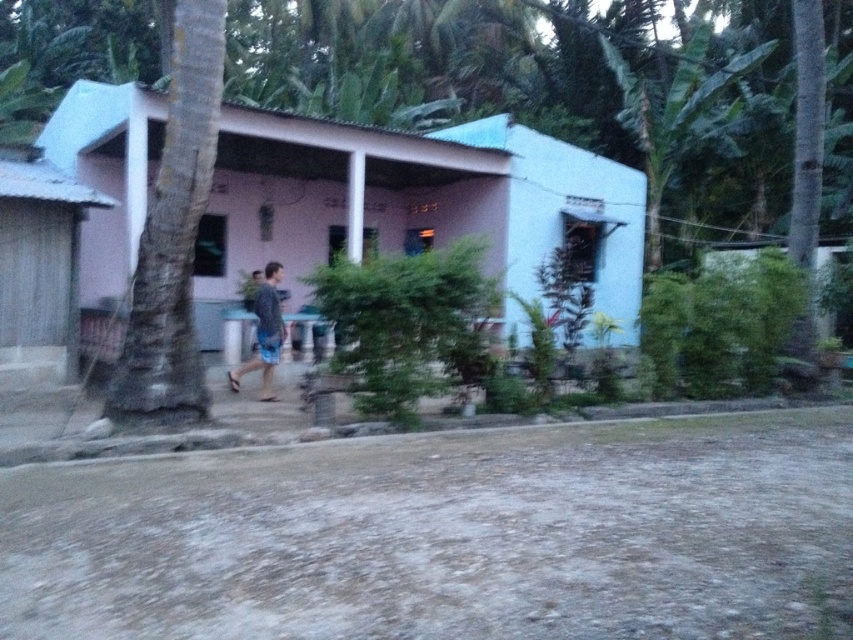
Which is in front, point (242, 122) or point (271, 268)?

Positioned in front is point (271, 268).

Consider the image. Is pink matte house at center below blue denim shorts at center?

Actually, pink matte house at center is above blue denim shorts at center.

Identify the location of pink matte house at center. (415, 205).